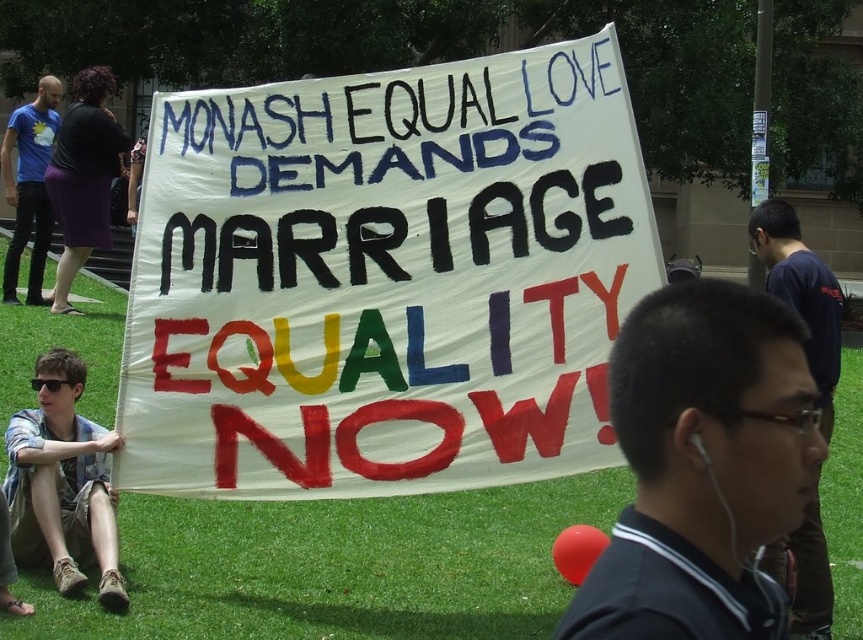
Question: Which of the following is the farthest from the observer?

Choices:
 (A) (0, 452)
 (B) (784, 417)
 (C) (55, 570)

Answer: (A)

Question: Does green grass at center come in front of blue t-shirt at left?

Choices:
 (A) no
 (B) yes

Answer: (B)

Question: Considering the relative positions of white paper sign at center and plaid shirt at lower left in the image provided, where is white paper sign at center located with respect to plaid shirt at lower left?

Choices:
 (A) below
 (B) above

Answer: (B)

Question: Can you confirm if plaid shirt at lower left is wider than blue t-shirt at left?

Choices:
 (A) no
 (B) yes

Answer: (A)

Question: Which object is farther from the camera taking this photo?

Choices:
 (A) blue t-shirt at left
 (B) green grass at center

Answer: (A)

Question: Among these objects, which one is nearest to the camera?

Choices:
 (A) dark blue shirt at center
 (B) green grass at center

Answer: (A)